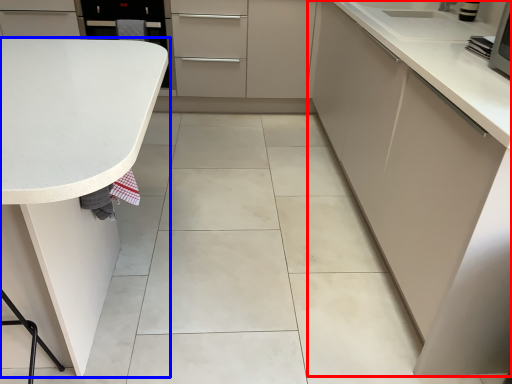
Question: Which point is further to the camera, cabinetry (highlighted by a red box) or countertop (highlighted by a blue box)?

Choices:
 (A) cabinetry
 (B) countertop

Answer: (A)